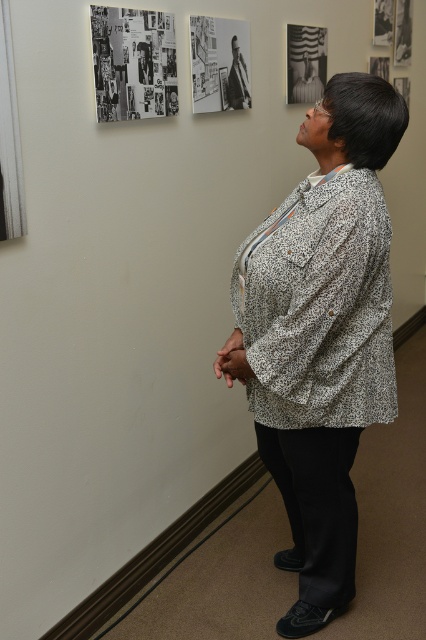
You are an interior designer who wants to hang a new painting between the white printed shirt at center and the metallic silver frame at upper center. Based on their sizes, which object should you place the new painting closer to?

The white printed shirt at center is much taller than the metallic silver frame at upper center. Therefore, to maintain visual balance, the new painting should be placed closer to the metallic silver frame at upper center to compensate for the size difference.

You are standing in a room where a woman is looking at a wall with several photographs. There is a point marked at coordinates [321,336]. What object is located at that point?

The point at coordinates [321,336] marks the white printed shirt at center.

You are a photographer trying to capture the white printed shirt at center and the black and white photograph at upper center in a single frame. Which object should you focus on first to ensure both are in focus?

The white printed shirt at center is closer to the viewer than the black and white photograph at upper center. To ensure both are in focus, you should focus on the white printed shirt at center first, as it is closer, and use a smaller aperture or adjust your focus point to cover the distance between them.